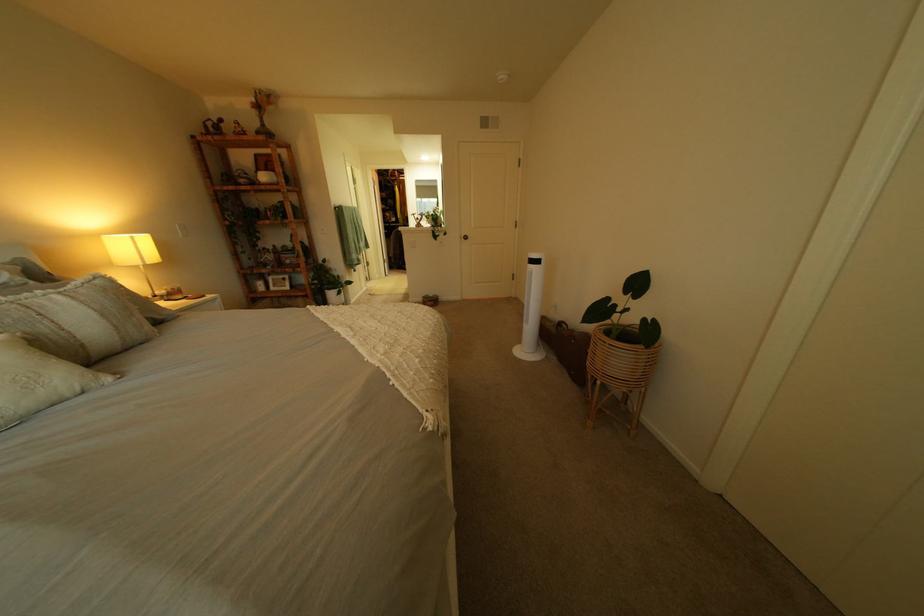
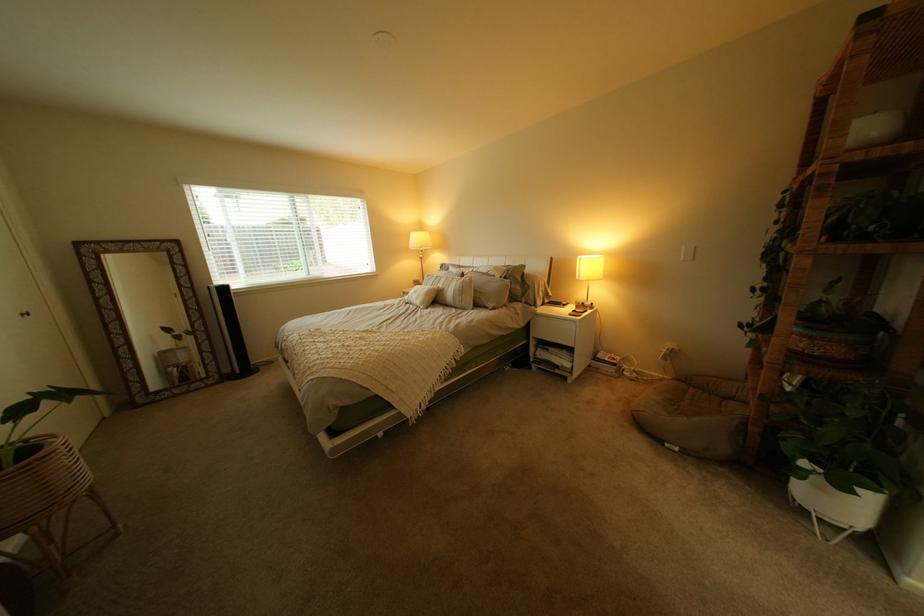
In the second image, find the point that corresponds to the point at 61,330 in the first image.

(462, 290)